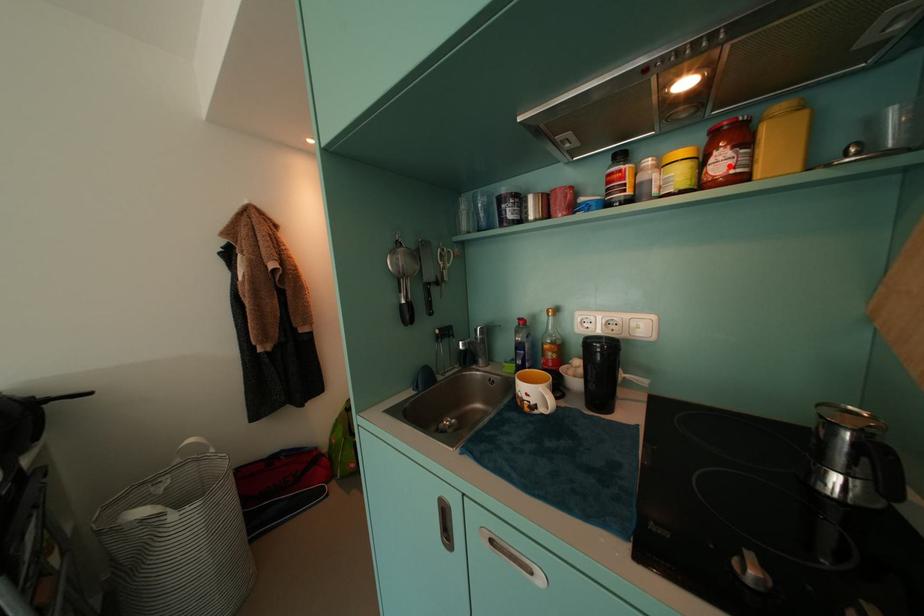
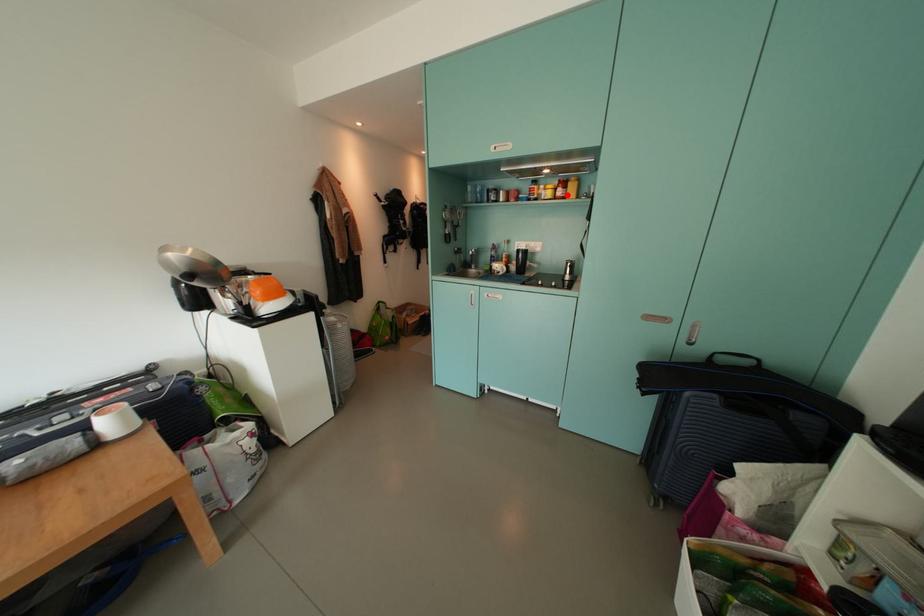
I am providing you with two images of the same scene from different viewpoints. A red point is marked on the first image and another point is marked on the second image. Do the highlighted points in image1 and image2 indicate the same real-world spot?

Yes